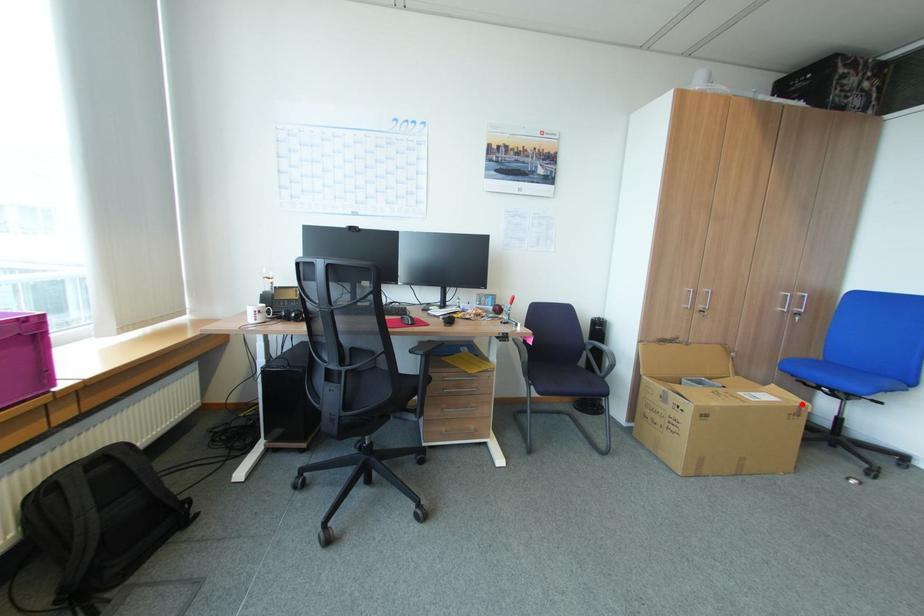
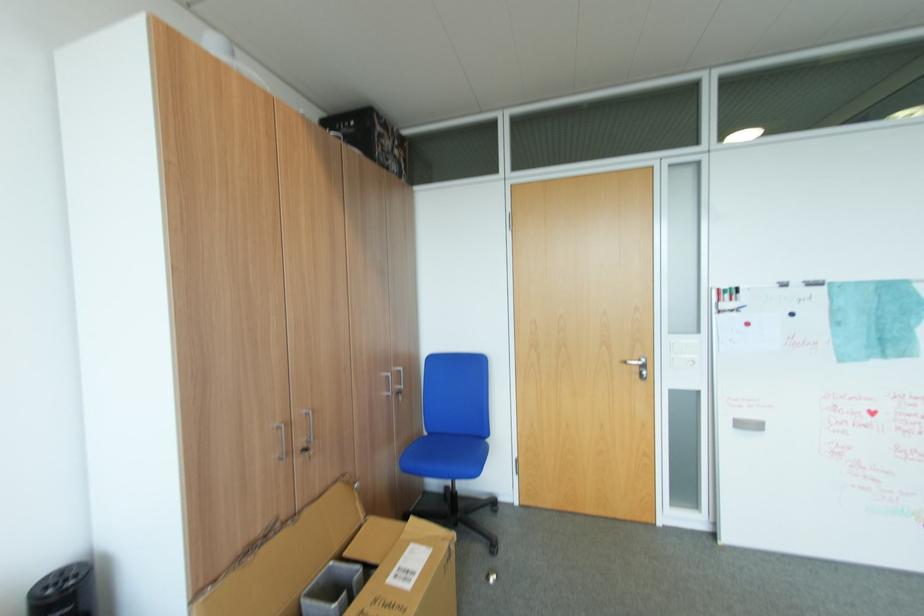
Where in the second image is the point corresponding to the highlighted location from the first image?

(451, 544)